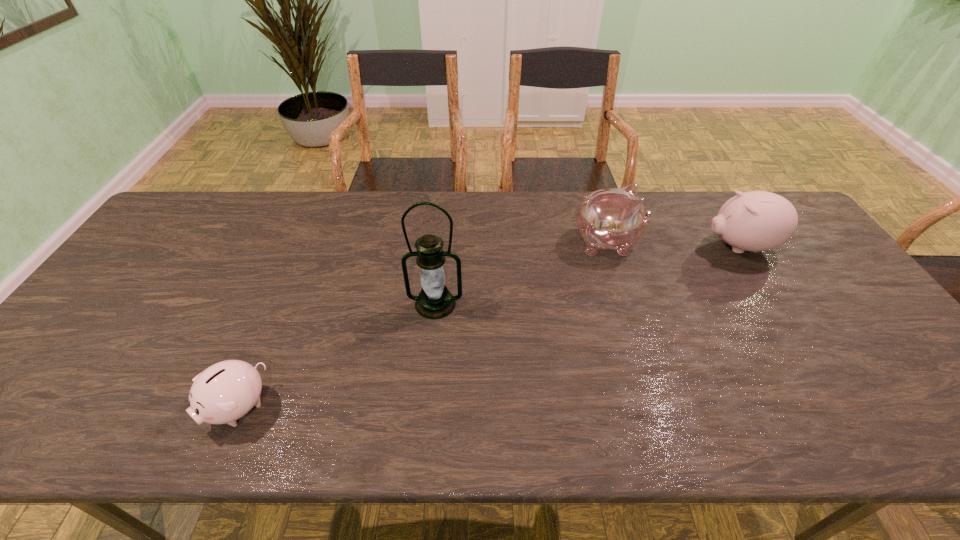
You are a GUI agent. You are given a task and a screenshot of the screen. Output one action in this format:
    pyautogui.click(x=<x>, y=<y>)
    Task: Click on the object that can be found as the second closest to the leftmost object
    Image resolution: width=960 pixels, height=540 pixels.
    Given the screenshot: What is the action you would take?
    pyautogui.click(x=614, y=218)

Point out which piggy bank is positioned as the second nearest to the third object from left to right. Please provide its 2D coordinates. Your answer should be formatted as a tuple, i.e. [(x, y)], where the tuple contains the x and y coordinates of a point satisfying the conditions above.

[(226, 391)]

Image resolution: width=960 pixels, height=540 pixels. In order to click on piggy bank that is the closest to the nearest piggy bank in this screenshot , I will do `click(614, 218)`.

You are a GUI agent. You are given a task and a screenshot of the screen. Output one action in this format:
    pyautogui.click(x=<x>, y=<y>)
    Task: Click on the free spot that satisfies the following two spatial constraints: 1. at the snout of the rightmost object; 2. on the front side of the shortest object
    This screenshot has height=540, width=960.
    Given the screenshot: What is the action you would take?
    pyautogui.click(x=841, y=408)

Where is `vacant area that satisfies the following two spatial constraints: 1. at the snout of the rightmost object; 2. on the front side of the nearest object`? vacant area that satisfies the following two spatial constraints: 1. at the snout of the rightmost object; 2. on the front side of the nearest object is located at coordinates (841, 408).

Find the location of `free space that satisfies the following two spatial constraints: 1. on the back side of the nearest piggy bank; 2. on the front facing side of the second piggy bank from right to left`. free space that satisfies the following two spatial constraints: 1. on the back side of the nearest piggy bank; 2. on the front facing side of the second piggy bank from right to left is located at coordinates (307, 242).

Locate an element on the screen. Image resolution: width=960 pixels, height=540 pixels. free space that satisfies the following two spatial constraints: 1. at the snout of the rightmost object; 2. on the front side of the shortest object is located at coordinates (841, 408).

At what (x,y) coordinates should I click in order to perform the action: click on vacant space that satisfies the following two spatial constraints: 1. at the snout of the rightmost object; 2. on the front side of the nearest object. Please return your answer as a coordinate pair (x, y). This screenshot has height=540, width=960. Looking at the image, I should click on (841, 408).